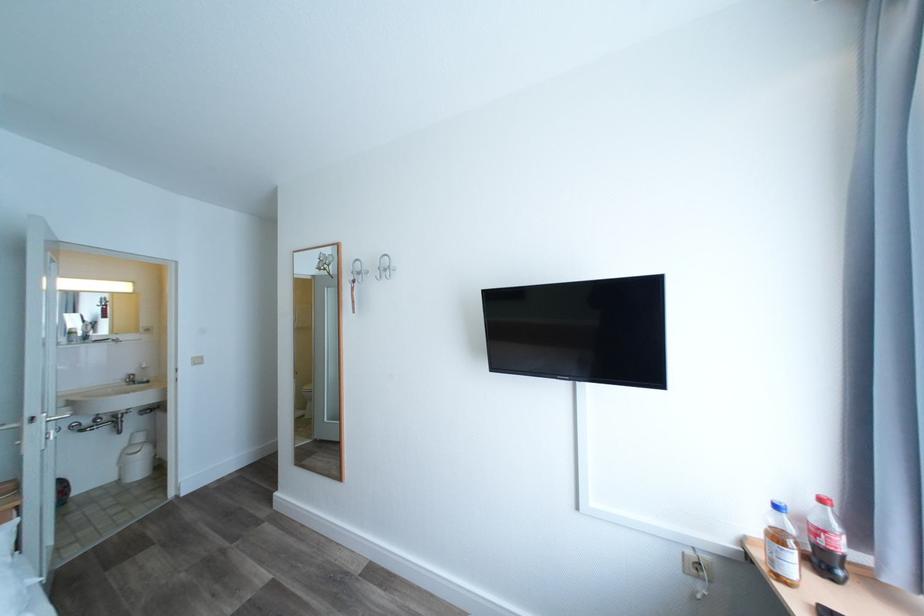
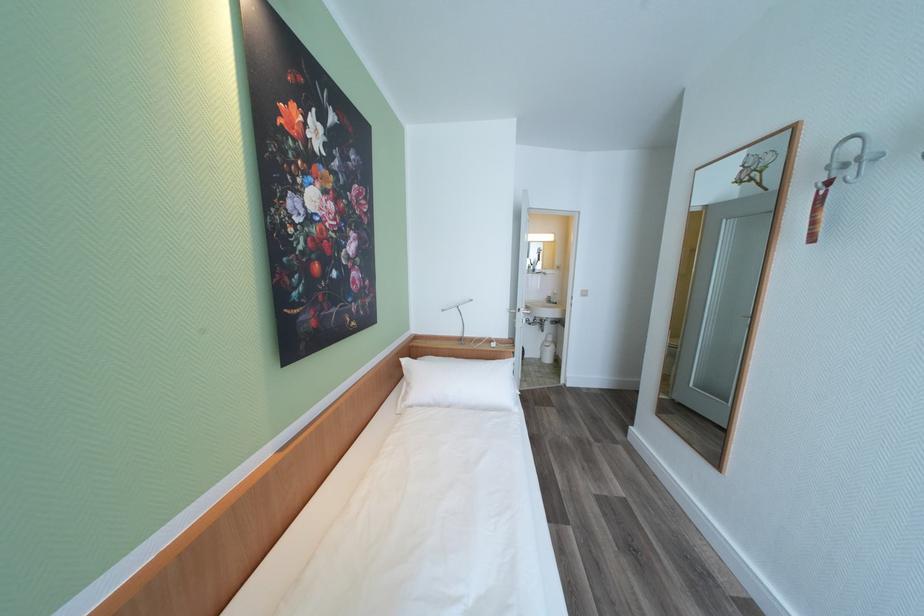
Where in the second image is the point corresponding to point (123, 480) from the first image?

(546, 359)